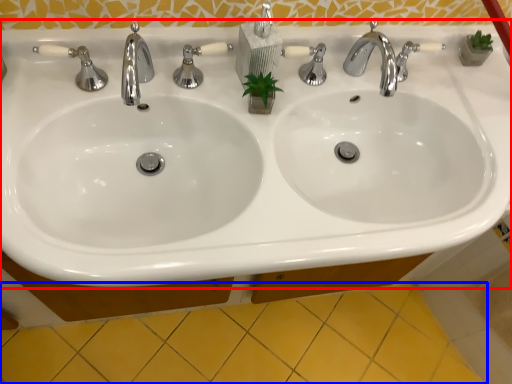
Question: Among these objects, which one is farthest to the camera, sink (highlighted by a red box) or ceramic tile (highlighted by a blue box)?

Choices:
 (A) sink
 (B) ceramic tile

Answer: (B)